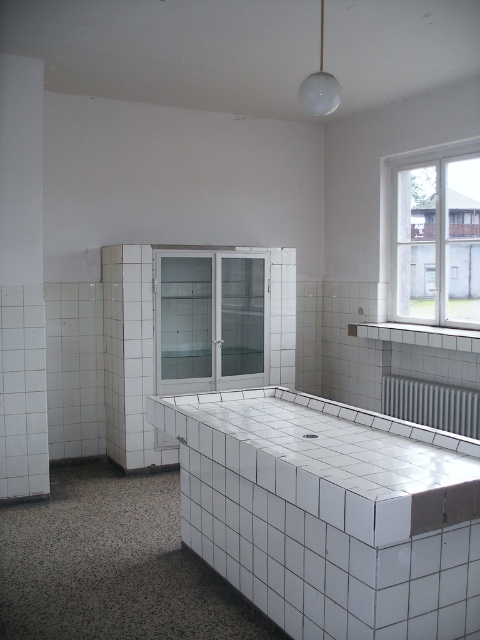
Between point (178, 420) and point (176, 316), which one is positioned behind?

The point (176, 316) is more distant.

Between white tile counter top at center and white glass cabinet at center, which one is positioned lower?

Positioned lower is white tile counter top at center.

Where is `white tile counter top at center`? white tile counter top at center is located at coordinates (333, 458).

Between white glass cabinet at center and white metallic radiator at lower right, which one has less height?

white metallic radiator at lower right

Between white glass cabinet at center and white metallic radiator at lower right, which one has more height?

Standing taller between the two is white glass cabinet at center.

The height and width of the screenshot is (640, 480). I want to click on white glass cabinet at center, so click(x=211, y=321).

What do you see at coordinates (436, 236) in the screenshot? This screenshot has height=640, width=480. I see `transparent glass window at upper right` at bounding box center [436, 236].

In the scene shown: Is transparent glass window at upper right above white metallic radiator at lower right?

Indeed, transparent glass window at upper right is positioned over white metallic radiator at lower right.

Where is `transparent glass window at upper right`? transparent glass window at upper right is located at coordinates (436, 236).